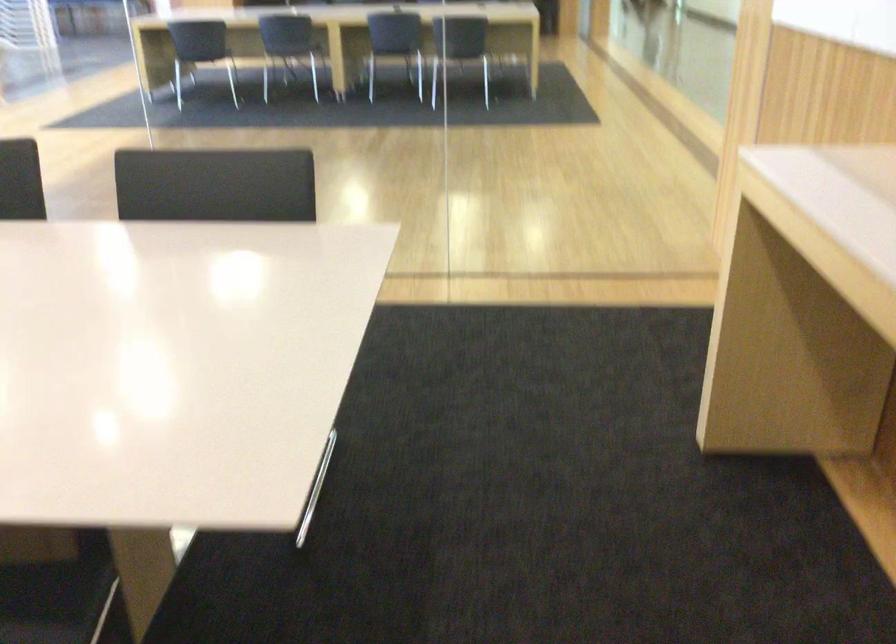
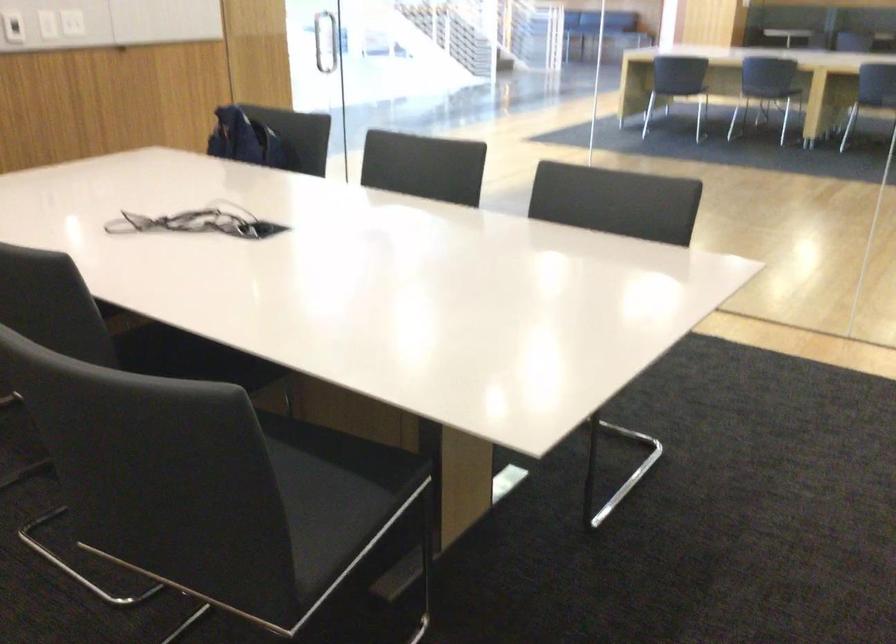
Question: The camera is either moving clockwise (left) or counter-clockwise (right) around the object. The first image is from the beginning of the video and the second image is from the end. Is the camera moving left or right when shooting the video?

Choices:
 (A) Left
 (B) Right

Answer: (B)